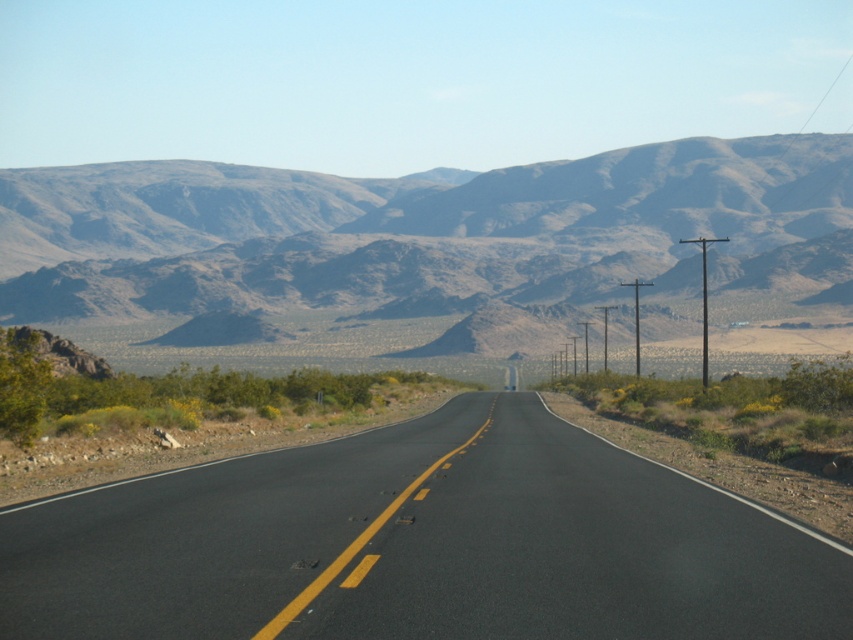
Can you confirm if black asphalt road at center is positioned to the right of brown rocky mountain range at upper center?

Yes, black asphalt road at center is to the right of brown rocky mountain range at upper center.

Describe the element at coordinates (421, 545) in the screenshot. Image resolution: width=853 pixels, height=640 pixels. I see `black asphalt road at center` at that location.

Where is `black asphalt road at center`? black asphalt road at center is located at coordinates (421, 545).

The width and height of the screenshot is (853, 640). Find the location of `black asphalt road at center`. black asphalt road at center is located at coordinates (421, 545).